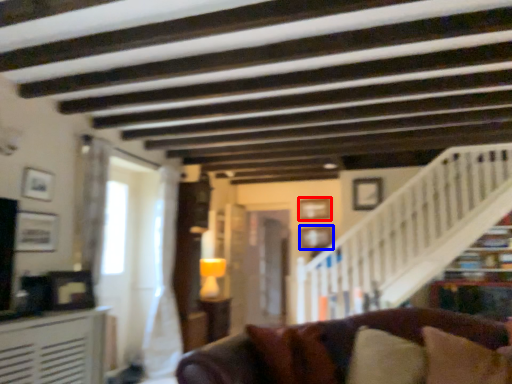
Question: Among these objects, which one is farthest to the camera, picture frame (highlighted by a red box) or picture frame (highlighted by a blue box)?

Choices:
 (A) picture frame
 (B) picture frame

Answer: (A)